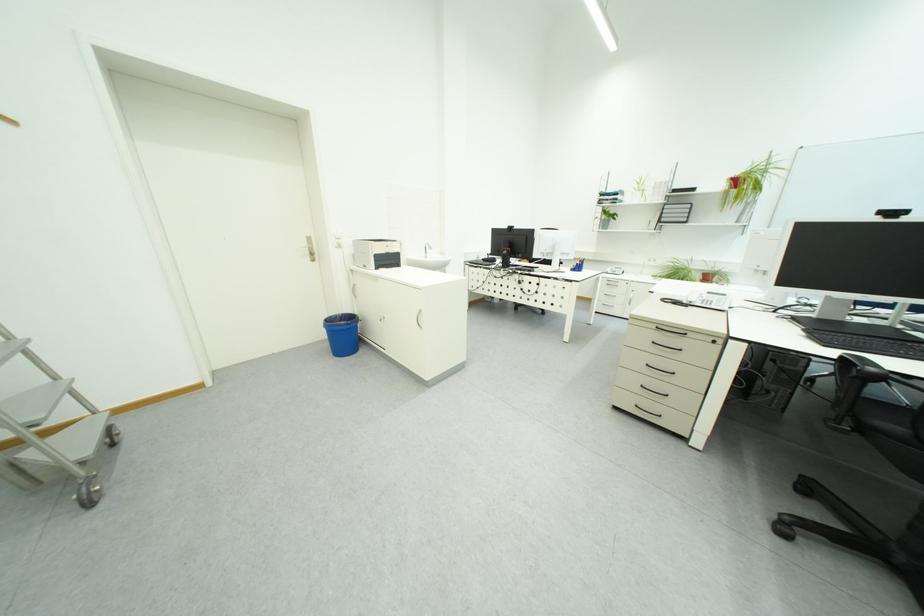
Image resolution: width=924 pixels, height=616 pixels. What do you see at coordinates (337, 241) in the screenshot?
I see `the white light switch` at bounding box center [337, 241].